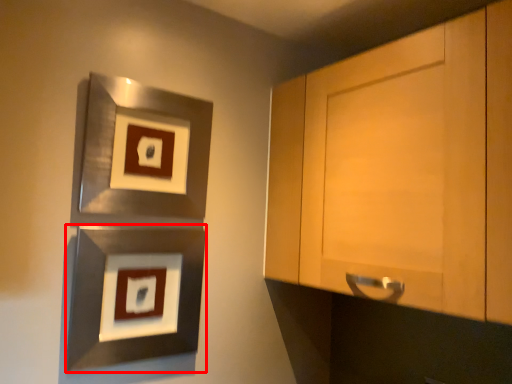
Question: From the image's perspective, where is picture frame (annotated by the red box) located relative to picture frame?

Choices:
 (A) above
 (B) below

Answer: (B)